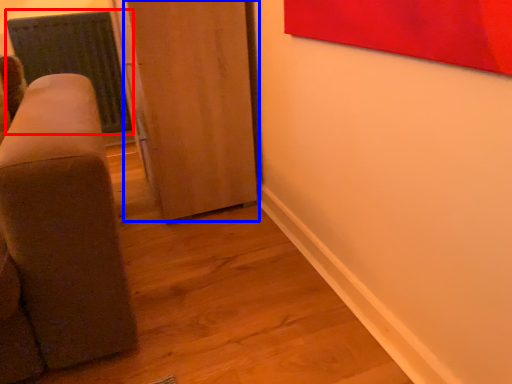
Question: Which object is further to the camera taking this photo, radiator (highlighted by a red box) or door (highlighted by a blue box)?

Choices:
 (A) radiator
 (B) door

Answer: (A)